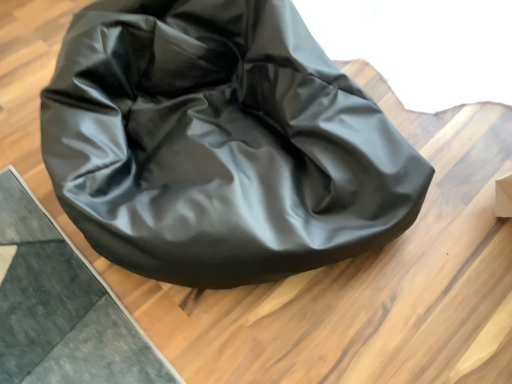
What do you see at coordinates (219, 144) in the screenshot? The image size is (512, 384). I see `black leather bean bag at center` at bounding box center [219, 144].

Find the location of a particular element. The image size is (512, 384). black leather bean bag at center is located at coordinates (219, 144).

Where is `black leather bean bag at center`? The image size is (512, 384). black leather bean bag at center is located at coordinates (219, 144).